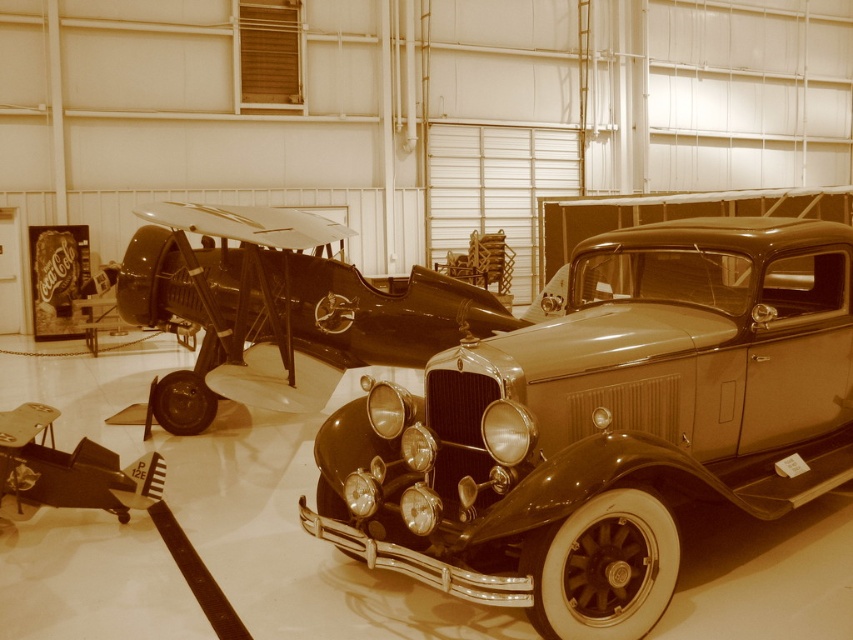
Does shiny black car at center appear over shiny black airplane at center?

No.

Can you confirm if shiny black car at center is positioned below shiny black airplane at center?

Yes, shiny black car at center is below shiny black airplane at center.

The height and width of the screenshot is (640, 853). I want to click on shiny black car at center, so click(x=606, y=424).

In order to click on shiny black car at center in this screenshot , I will do `click(606, 424)`.

Based on the photo, does shiny black airplane at center appear on the right side of metallic silver car at center?

Yes, shiny black airplane at center is to the right of metallic silver car at center.

Measure the distance between shiny black airplane at center and metallic silver car at center.

shiny black airplane at center is 1.73 meters from metallic silver car at center.

Between point (277, 259) and point (39, 422), which one is positioned in front?

Positioned in front is point (39, 422).

You are a GUI agent. You are given a task and a screenshot of the screen. Output one action in this format:
    pyautogui.click(x=<x>, y=<y>)
    Task: Click on the shiny black airplane at center
    The height and width of the screenshot is (640, 853).
    Given the screenshot: What is the action you would take?
    pyautogui.click(x=279, y=308)

Is point (654, 404) farther from viewer compared to point (13, 417)?

No, (654, 404) is closer to viewer.

Does shiny black car at center have a smaller size compared to metallic silver car at center?

No, shiny black car at center is not smaller than metallic silver car at center.

Describe the element at coordinates (606, 424) in the screenshot. This screenshot has width=853, height=640. I see `shiny black car at center` at that location.

Locate an element on the screen. This screenshot has width=853, height=640. shiny black car at center is located at coordinates (606, 424).